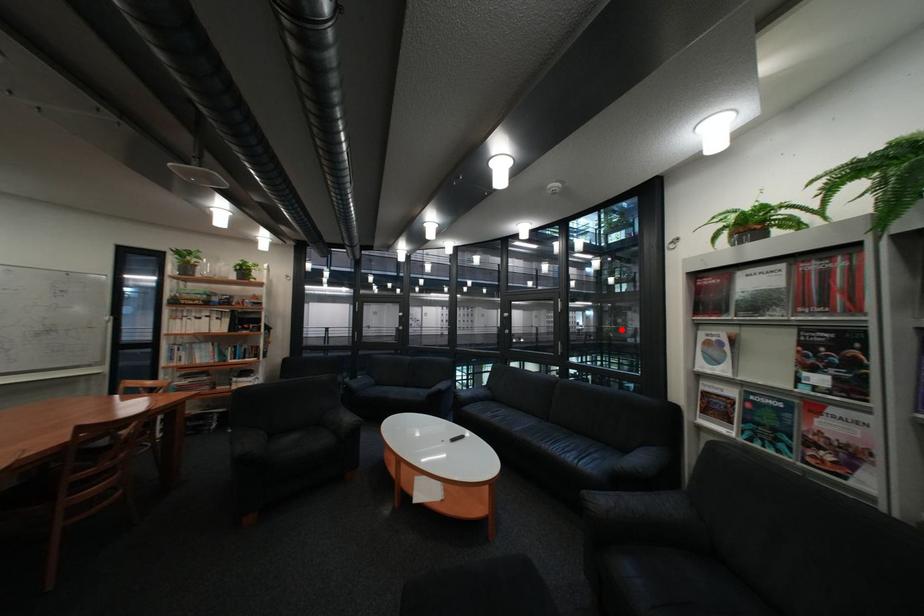
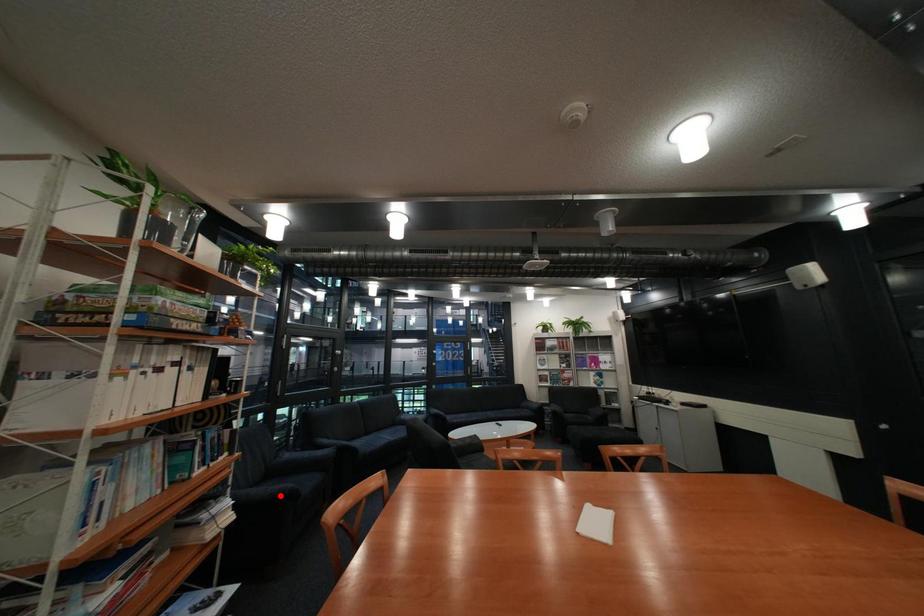
I am providing you with two images of the same scene from different viewpoints. A red point is marked on the first image and another point is marked on the second image. Are the points marked in image1 and image2 representing the same 3D position?

No